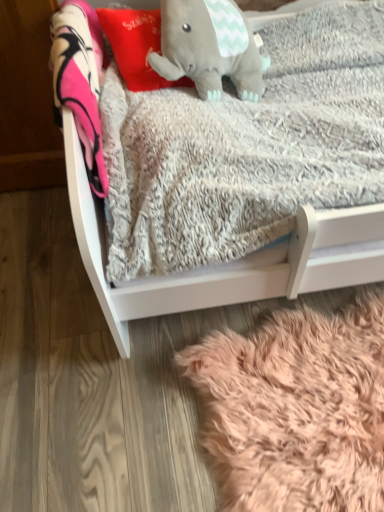
Question: From the image's perspective, is gray plush elephant at upper center located above or below fuzzy pink rug at lower right?

Choices:
 (A) below
 (B) above

Answer: (B)

Question: Considering the positions of point (261, 65) and point (236, 448), is point (261, 65) closer or farther from the camera than point (236, 448)?

Choices:
 (A) farther
 (B) closer

Answer: (A)

Question: Which is farther from the white soft wood infant bed at center?

Choices:
 (A) fuzzy pink rug at lower right
 (B) gray plush elephant at upper center
 (C) red plush pillow at upper center

Answer: (C)

Question: Which object is positioned farthest from the red plush pillow at upper center?

Choices:
 (A) gray plush elephant at upper center
 (B) white soft wood infant bed at center
 (C) fuzzy pink rug at lower right

Answer: (C)